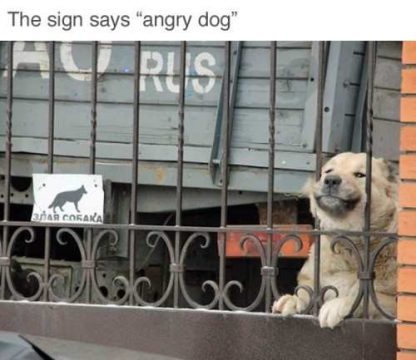
You are a GUI agent. You are given a task and a screenshot of the screen. Output one action in this format:
    pyautogui.click(x=<x>, y=<y>)
    Task: Click on the brick pillar
    The image size is (416, 360).
    Given the screenshot: What is the action you would take?
    pyautogui.click(x=411, y=250)